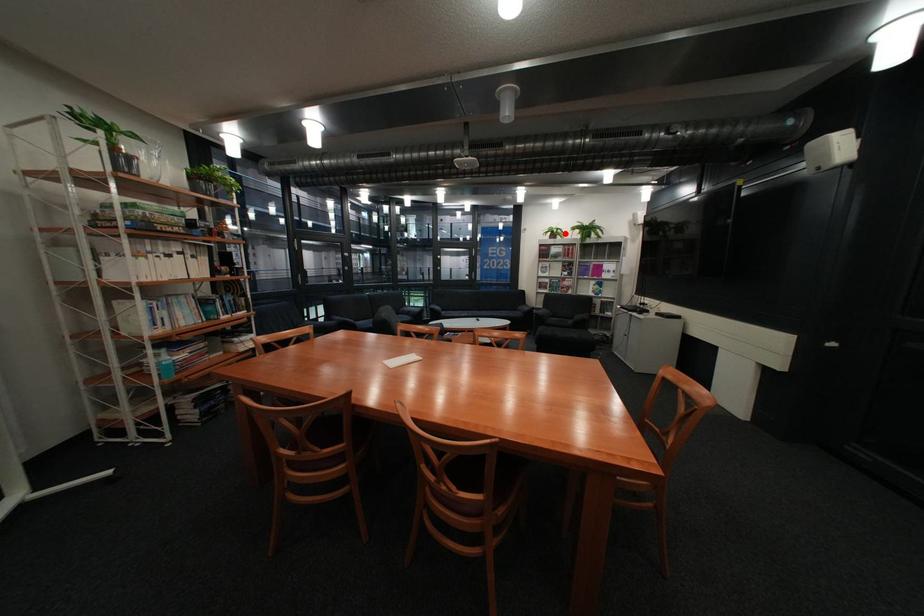
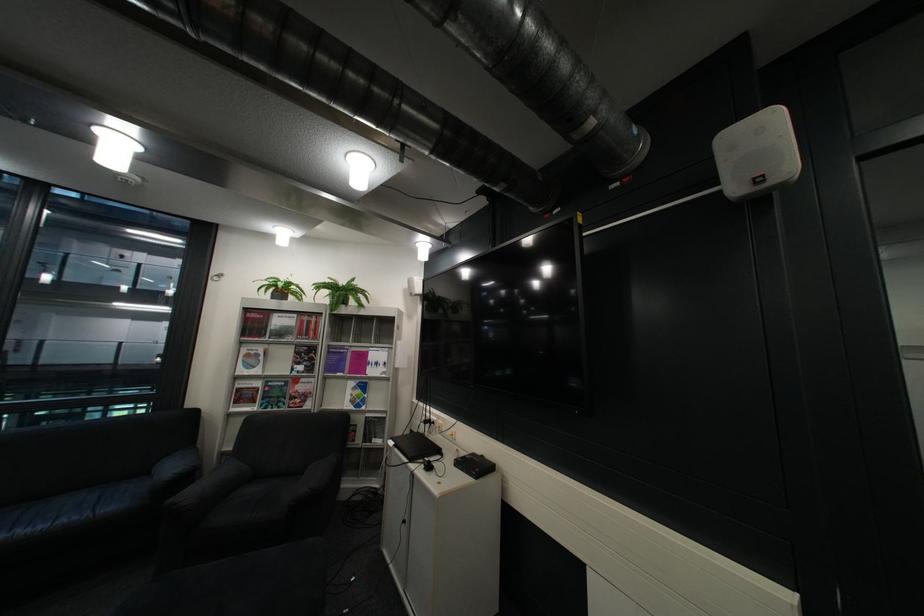
Question: I am providing you with two images of the same scene from different viewpoints. Image1 has a red point marked. In image2, the corresponding 3D location appears at what relative position? Reply with the corresponding letter.

Choices:
 (A) Closer
 (B) Farther

Answer: (B)